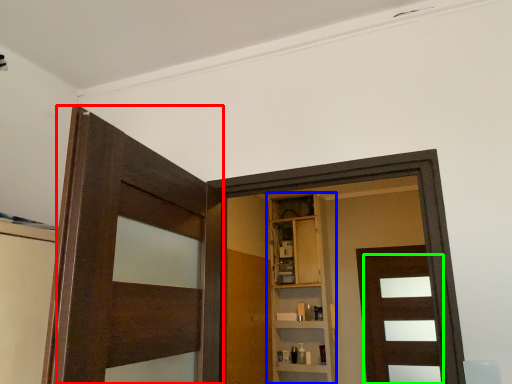
Question: Which object is positioned farthest from door (highlighted by a red box)? Select from cabinetry (highlighted by a blue box) and door (highlighted by a green box).

Choices:
 (A) cabinetry
 (B) door

Answer: (B)